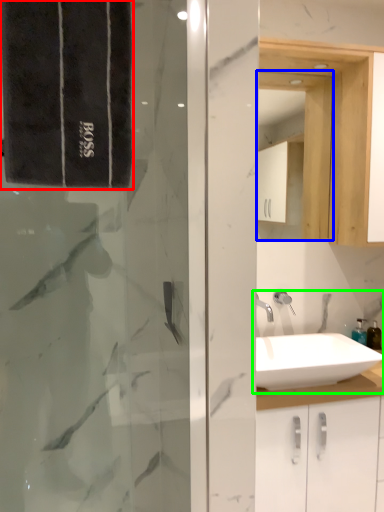
Question: Which is farther away from bath towel (highlighted by a red box)? medicine cabinet (highlighted by a blue box) or sink (highlighted by a green box)?

Choices:
 (A) medicine cabinet
 (B) sink

Answer: (A)